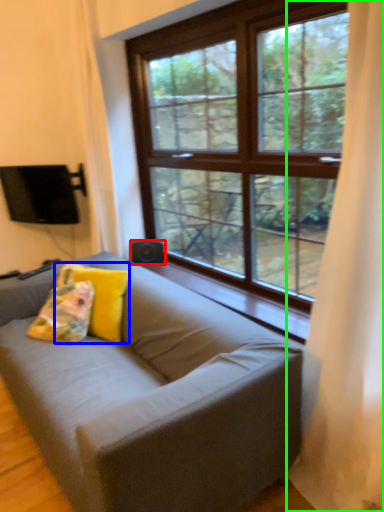
Question: Based on their relative distances, which object is nearer to speaker (highlighted by a red box)? Choose from pillow (highlighted by a blue box) and curtain (highlighted by a green box).

Choices:
 (A) pillow
 (B) curtain

Answer: (A)